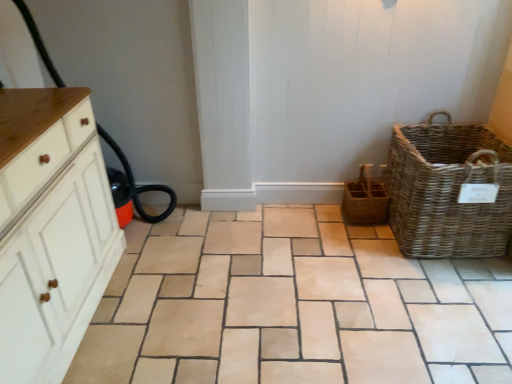
Locate an element on the screen. free point in front of natural woven picnic basket at right is located at coordinates (449, 291).